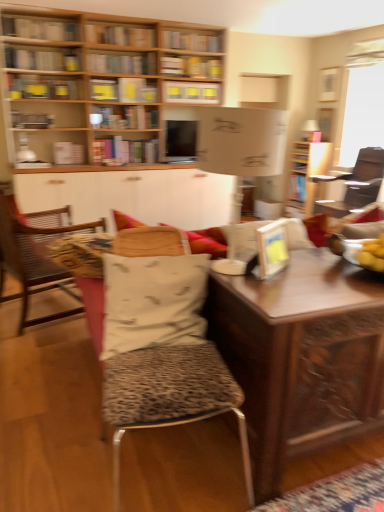
Image resolution: width=384 pixels, height=512 pixels. Identify the location of free space in front of hardcover book at upper left, the ninth book from the top. (69, 162).